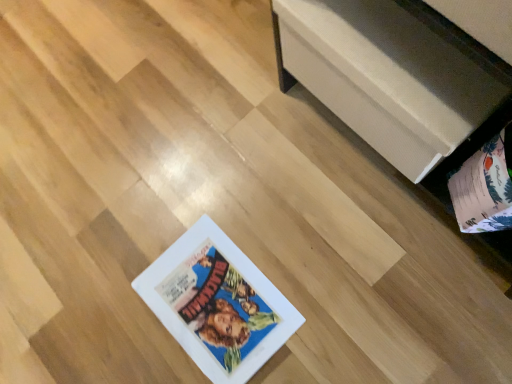
Question: From the image's perspective, is matte paper album at lower right above or below white matte storage chest at upper right?

Choices:
 (A) below
 (B) above

Answer: (A)

Question: From their relative heights in the image, would you say matte paper album at lower right is taller or shorter than white matte storage chest at upper right?

Choices:
 (A) short
 (B) tall

Answer: (B)

Question: Considering the relative positions of matte paper album at lower right and white matte storage chest at upper right in the image provided, is matte paper album at lower right to the left or to the right of white matte storage chest at upper right?

Choices:
 (A) left
 (B) right

Answer: (B)

Question: Is point (356, 36) closer or farther from the camera than point (489, 190)?

Choices:
 (A) closer
 (B) farther

Answer: (B)

Question: From a real-world perspective, is white matte storage chest at upper right positioned above or below matte paper album at lower right?

Choices:
 (A) below
 (B) above

Answer: (B)

Question: Looking at their shapes, would you say white matte storage chest at upper right is wider or thinner than matte paper album at lower right?

Choices:
 (A) wide
 (B) thin

Answer: (B)

Question: Would you say white matte storage chest at upper right is to the left or to the right of matte paper album at lower right in the picture?

Choices:
 (A) left
 (B) right

Answer: (A)